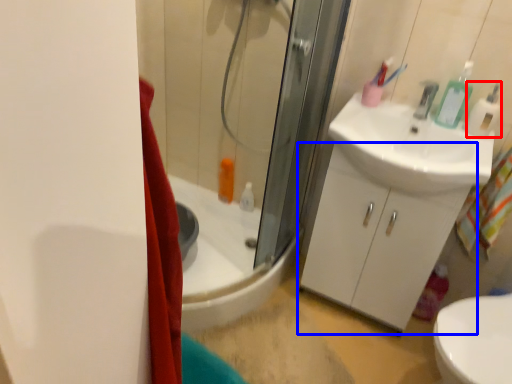
Question: Which of the following is the closest to the observer, soap dispenser (highlighted by a red box) or bathroom cabinet (highlighted by a blue box)?

Choices:
 (A) soap dispenser
 (B) bathroom cabinet

Answer: (A)